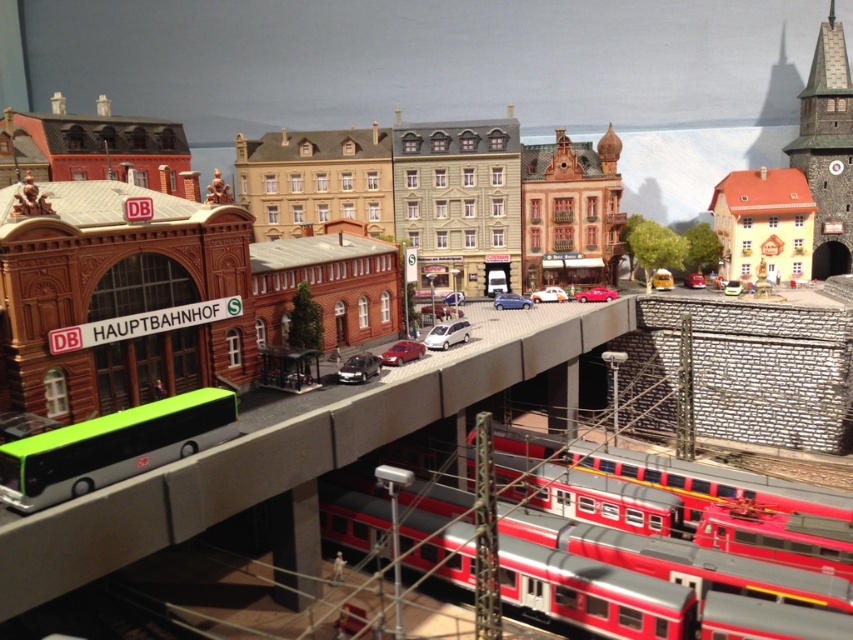
This screenshot has height=640, width=853. What are the coordinates of `satin silver car at center` in the screenshot? It's located at (447, 333).

Which is behind, point (445, 333) or point (419, 342)?

Positioned behind is point (445, 333).

The image size is (853, 640). What are the coordinates of `satin silver car at center` in the screenshot? It's located at (447, 333).

Measure the distance between concrete bridge at center and camera.

concrete bridge at center is 21.28 meters from camera.

You are a GUI agent. You are given a task and a screenshot of the screen. Output one action in this format:
    pyautogui.click(x=<x>, y=<y>)
    Task: Click on the concrete bridge at center
    The height and width of the screenshot is (640, 853).
    Given the screenshot: What is the action you would take?
    pyautogui.click(x=274, y=460)

Which is behind, point (410, 432) or point (366, 364)?

Positioned behind is point (366, 364).

You are a GUI agent. You are given a task and a screenshot of the screen. Output one action in this format:
    pyautogui.click(x=<x>, y=<y>)
    Task: Click on the concrete bridge at center
    The height and width of the screenshot is (640, 853).
    Given the screenshot: What is the action you would take?
    pyautogui.click(x=274, y=460)

Does red matte passenger train at lower center have a larger size compared to shiny red car at center?

Indeed, red matte passenger train at lower center has a larger size compared to shiny red car at center.

Which is in front, point (627, 548) or point (614, 291)?

Point (627, 548) is more forward.

Where is `red matte passenger train at lower center`? Image resolution: width=853 pixels, height=640 pixels. red matte passenger train at lower center is located at coordinates (660, 584).